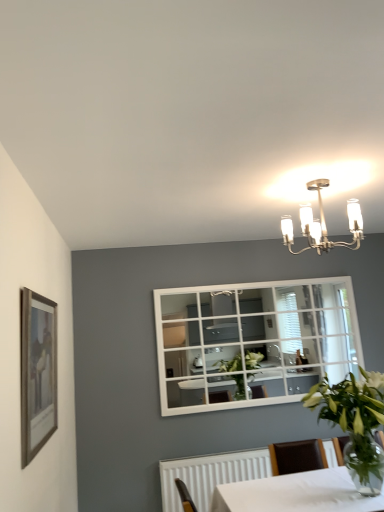
Question: Considering the relative sizes of satin nickel chandelier at upper center and wooden framed picture at left in the image provided, is satin nickel chandelier at upper center shorter than wooden framed picture at left?

Choices:
 (A) yes
 (B) no

Answer: (A)

Question: Is satin nickel chandelier at upper center looking in the opposite direction of wooden framed picture at left?

Choices:
 (A) yes
 (B) no

Answer: (B)

Question: Does satin nickel chandelier at upper center come in front of wooden framed picture at left?

Choices:
 (A) yes
 (B) no

Answer: (B)

Question: Is satin nickel chandelier at upper center far from wooden framed picture at left?

Choices:
 (A) yes
 (B) no

Answer: (A)

Question: Is satin nickel chandelier at upper center not within wooden framed picture at left?

Choices:
 (A) yes
 (B) no

Answer: (A)

Question: Considering the relative sizes of satin nickel chandelier at upper center and wooden framed picture at left in the image provided, is satin nickel chandelier at upper center taller than wooden framed picture at left?

Choices:
 (A) yes
 (B) no

Answer: (B)

Question: Does wooden framed picture at left have a lesser width compared to green leafy plant in clear glass vase at lower right?

Choices:
 (A) no
 (B) yes

Answer: (B)

Question: Is wooden framed picture at left to the left of green leafy plant in clear glass vase at lower right from the viewer's perspective?

Choices:
 (A) no
 (B) yes

Answer: (B)

Question: From a real-world perspective, is wooden framed picture at left positioned under green leafy plant in clear glass vase at lower right based on gravity?

Choices:
 (A) no
 (B) yes

Answer: (A)

Question: From the image's perspective, is wooden framed picture at left over green leafy plant in clear glass vase at lower right?

Choices:
 (A) yes
 (B) no

Answer: (A)

Question: Would you consider wooden framed picture at left to be distant from green leafy plant in clear glass vase at lower right?

Choices:
 (A) no
 (B) yes

Answer: (B)

Question: Is wooden framed picture at left aimed at green leafy plant in clear glass vase at lower right?

Choices:
 (A) yes
 (B) no

Answer: (A)

Question: From the image's perspective, is wooden framed picture at left on top of satin nickel chandelier at upper center?

Choices:
 (A) yes
 (B) no

Answer: (B)